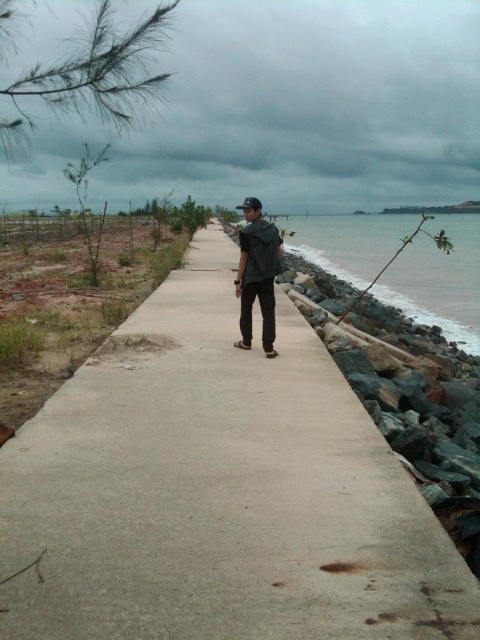
Question: Which object is closer to the camera taking this photo?

Choices:
 (A) dark gray fabric backpack at center
 (B) green stone water at right
 (C) concrete at center
 (D) dark gray cloudy sky at upper center

Answer: (C)

Question: Can you confirm if dark gray cloudy sky at upper center is positioned below dark gray fabric backpack at center?

Choices:
 (A) yes
 (B) no

Answer: (B)

Question: Estimate the real-world distances between objects in this image. Which object is farther from the dark gray cloudy sky at upper center?

Choices:
 (A) green stone water at right
 (B) dark gray fabric backpack at center
 (C) concrete at center

Answer: (B)

Question: Can you confirm if dark gray cloudy sky at upper center is positioned above dark gray fabric backpack at center?

Choices:
 (A) yes
 (B) no

Answer: (A)

Question: Estimate the real-world distances between objects in this image. Which object is farther from the dark gray cloudy sky at upper center?

Choices:
 (A) green stone water at right
 (B) dark gray fabric backpack at center
 (C) concrete at center

Answer: (B)

Question: Is concrete at center smaller than dark gray cloudy sky at upper center?

Choices:
 (A) yes
 (B) no

Answer: (A)